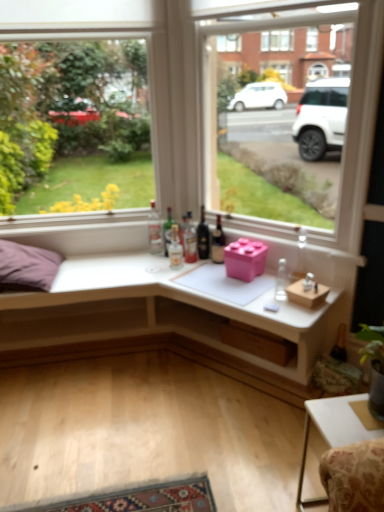
You are a GUI agent. You are given a task and a screenshot of the screen. Output one action in this format:
    pyautogui.click(x=<x>, y=<y>)
    Task: Click on the vacant space to the right of translucent glass bottle at center, marked as the 3th bottle in a left-to-right arrangement
    The image size is (384, 512).
    Given the screenshot: What is the action you would take?
    click(x=200, y=270)